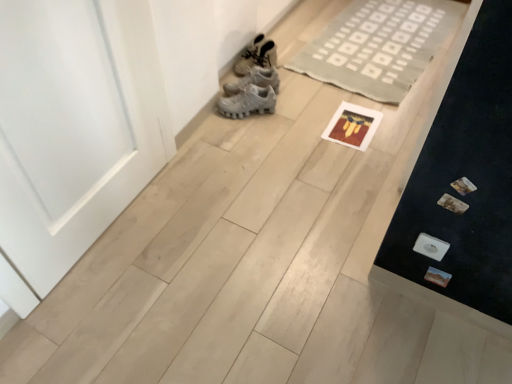
Question: Considering the relative sizes of white matte door at left and white matte sneakers at upper center in the image provided, is white matte door at left shorter than white matte sneakers at upper center?

Choices:
 (A) no
 (B) yes

Answer: (A)

Question: Are white matte door at left and white matte sneakers at upper center located far from each other?

Choices:
 (A) no
 (B) yes

Answer: (A)

Question: Considering the relative sizes of white matte door at left and white matte sneakers at upper center in the image provided, is white matte door at left taller than white matte sneakers at upper center?

Choices:
 (A) no
 (B) yes

Answer: (B)

Question: Does white matte door at left appear on the right side of white matte sneakers at upper center?

Choices:
 (A) no
 (B) yes

Answer: (A)

Question: Is white matte door at left facing towards white matte sneakers at upper center?

Choices:
 (A) yes
 (B) no

Answer: (B)

Question: Is white matte door at left wider than white matte sneakers at upper center?

Choices:
 (A) yes
 (B) no

Answer: (B)

Question: Is white matte door at left with neutral woven rug at upper center?

Choices:
 (A) yes
 (B) no

Answer: (B)

Question: Is neutral woven rug at upper center a part of white matte door at left?

Choices:
 (A) yes
 (B) no

Answer: (B)

Question: Does white matte door at left come in front of neutral woven rug at upper center?

Choices:
 (A) no
 (B) yes

Answer: (B)

Question: Is white matte door at left at the left side of neutral woven rug at upper center?

Choices:
 (A) yes
 (B) no

Answer: (A)

Question: Does white matte door at left have a lesser height compared to neutral woven rug at upper center?

Choices:
 (A) no
 (B) yes

Answer: (A)

Question: Is white matte door at left positioned behind neutral woven rug at upper center?

Choices:
 (A) yes
 (B) no

Answer: (B)

Question: From the image's perspective, is neutral woven rug at upper center located beneath white matte sneakers at upper center?

Choices:
 (A) yes
 (B) no

Answer: (B)